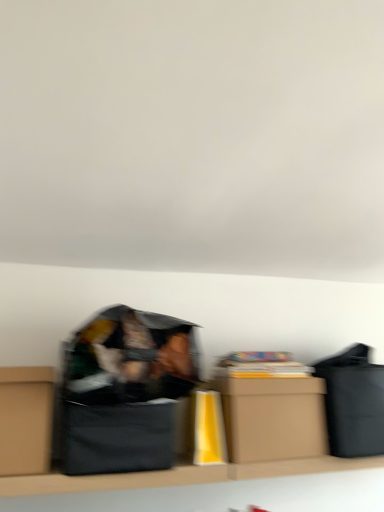
Question: Visually, is black cardboard box at center positioned to the left or to the right of brown cardboard box at left, which appears as the 1th box when viewed from the left?

Choices:
 (A) right
 (B) left

Answer: (A)

Question: Is point (137, 467) closer or farther from the camera than point (41, 455)?

Choices:
 (A) farther
 (B) closer

Answer: (A)

Question: Which is nearer to the brown cardboard box at left, which is the second box in right-to-left order?

Choices:
 (A) black cardboard box at center
 (B) brown cardboard box at center, the 1th box viewed from the right

Answer: (A)

Question: Which of these objects is positioned farthest from the brown cardboard box at center, the 2th box from the left?

Choices:
 (A) brown cardboard box at left, which is the second box in right-to-left order
 (B) black cardboard box at center

Answer: (A)